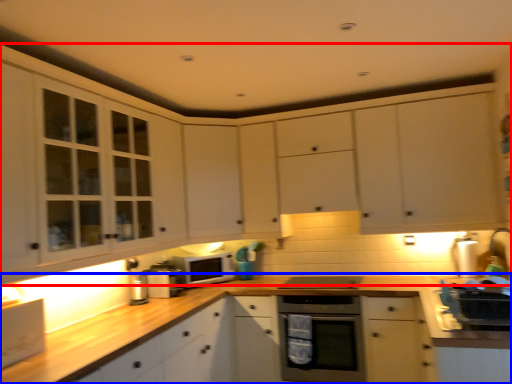
Question: Among these objects, which one is nearest to the camera, cabinetry (highlighted by a red box) or countertop (highlighted by a blue box)?

Choices:
 (A) cabinetry
 (B) countertop

Answer: (A)